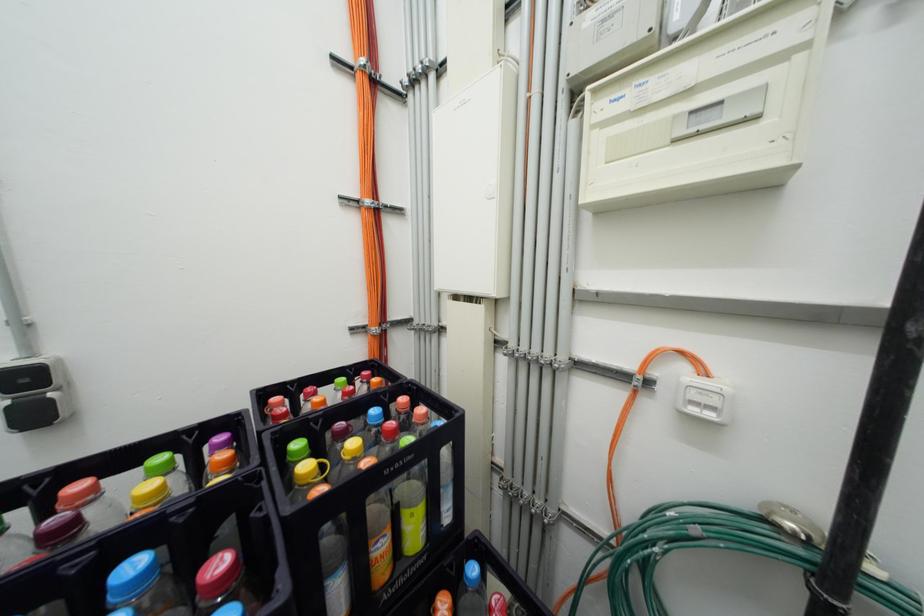
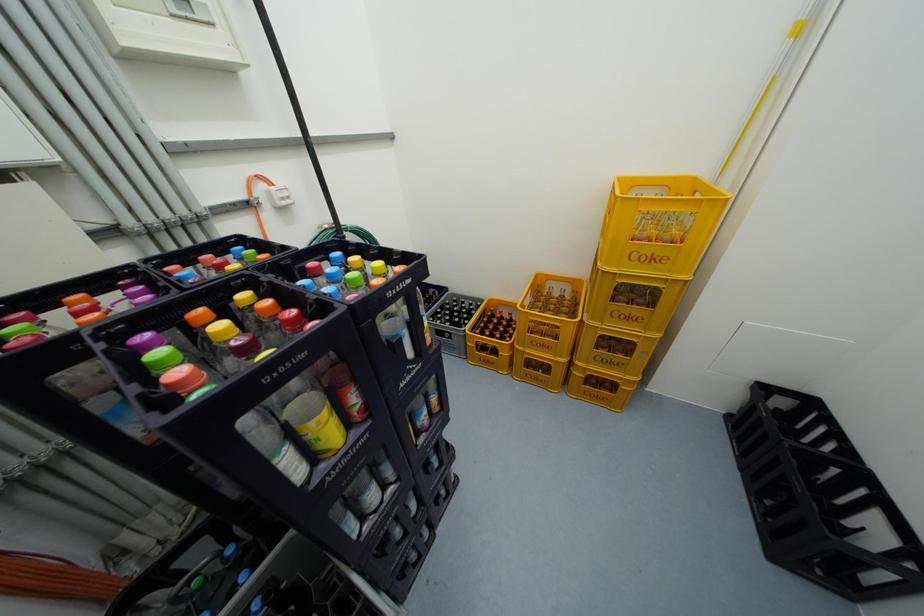
The images are taken continuously from a first-person perspective. In which direction is your viewpoint rotating?

The rotation direction of the camera is right-down.